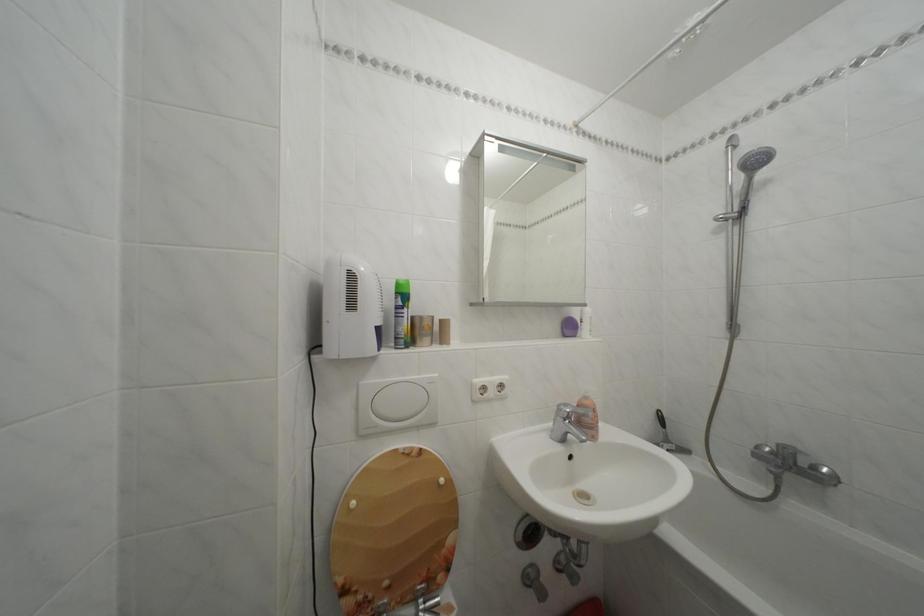
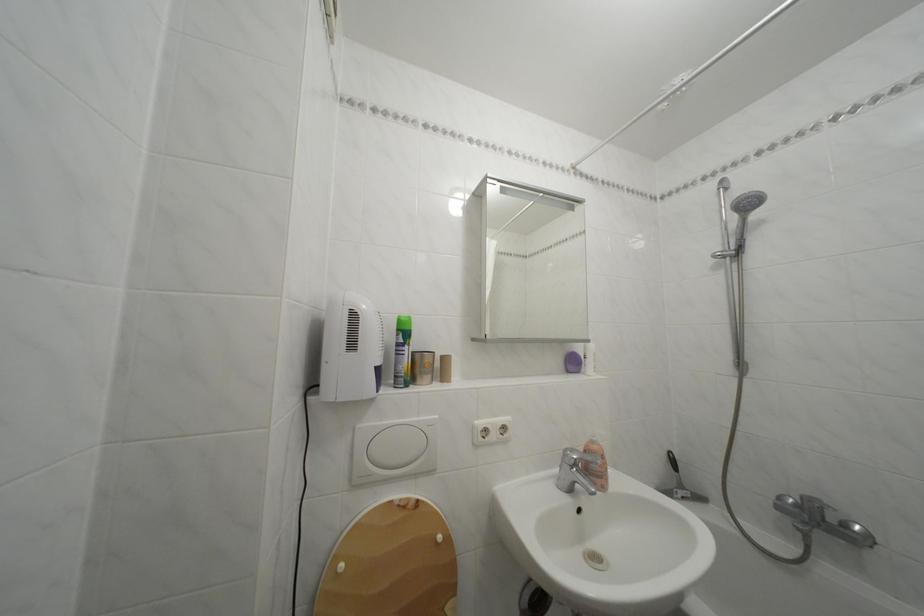
Locate, in the second image, the point that corresponds to (x=675, y=447) in the first image.

(689, 492)